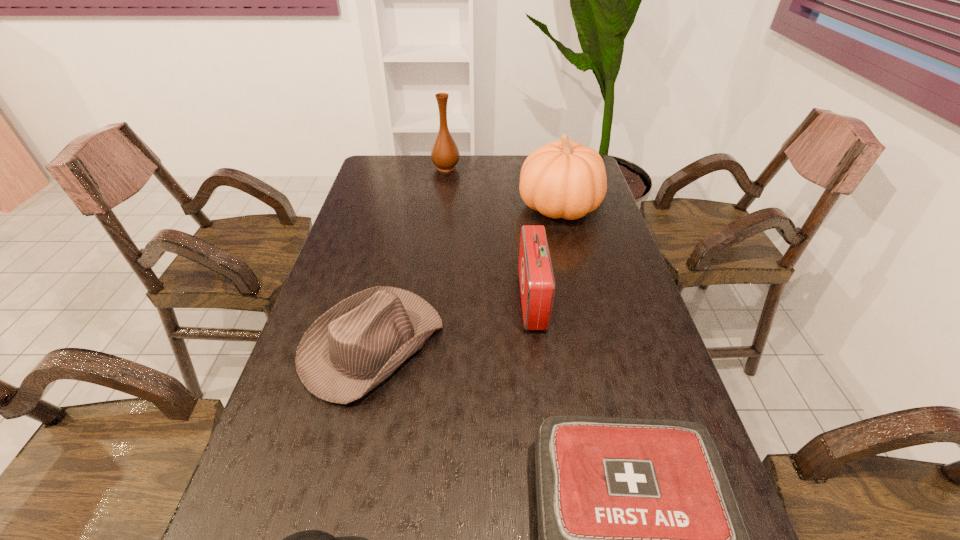
Locate an element on the screen. vacant space in between the fedora and the fifth nearest object is located at coordinates (466, 276).

You are a GUI agent. You are given a task and a screenshot of the screen. Output one action in this format:
    pyautogui.click(x=<x>, y=<y>)
    Task: Click on the vacant area that lies between the fedora and the farthest object
    This screenshot has width=960, height=540.
    Given the screenshot: What is the action you would take?
    pyautogui.click(x=410, y=256)

The image size is (960, 540). Identify the location of free spot between the farther first-aid kit and the fedora. (452, 322).

Identify the location of free area in between the fedora and the farthest object. (410, 256).

Where is `free point between the vase and the pumpkin`? This screenshot has width=960, height=540. free point between the vase and the pumpkin is located at coordinates (502, 187).

Find the location of a particular element. The width and height of the screenshot is (960, 540). empty space between the farther first-aid kit and the farthest object is located at coordinates (489, 234).

Point out which object is positioned as the third nearest to the pumpkin. Please provide its 2D coordinates. Your answer should be formatted as a tuple, i.e. [(x, y)], where the tuple contains the x and y coordinates of a point satisfying the conditions above.

[(357, 344)]

Identify which object is the fifth nearest to the fifth nearest object. Please provide its 2D coordinates. Your answer should be formatted as a tuple, i.e. [(x, y)], where the tuple contains the x and y coordinates of a point satisfying the conditions above.

[(310, 539)]